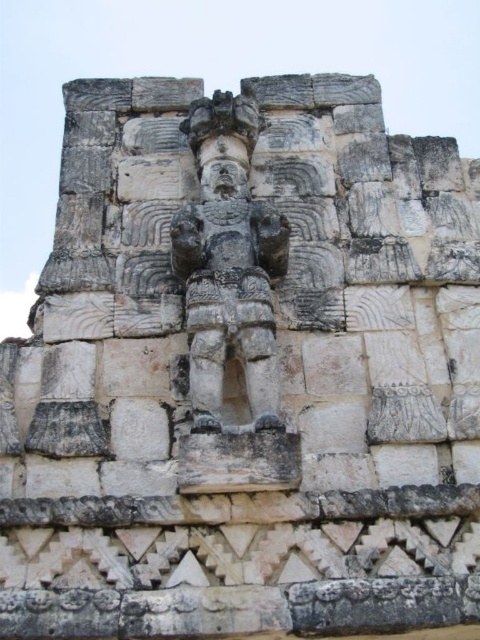
Is point (189, 358) in front of point (208, 170)?

That is True.

Who is more distant from viewer, (244, 364) or (232, 179)?

The point (232, 179) is behind.

Is point (226, 212) positioned after point (230, 188)?

No, (226, 212) is in front of (230, 188).

Where is `gray stone figure at center`? The width and height of the screenshot is (480, 640). gray stone figure at center is located at coordinates (230, 301).